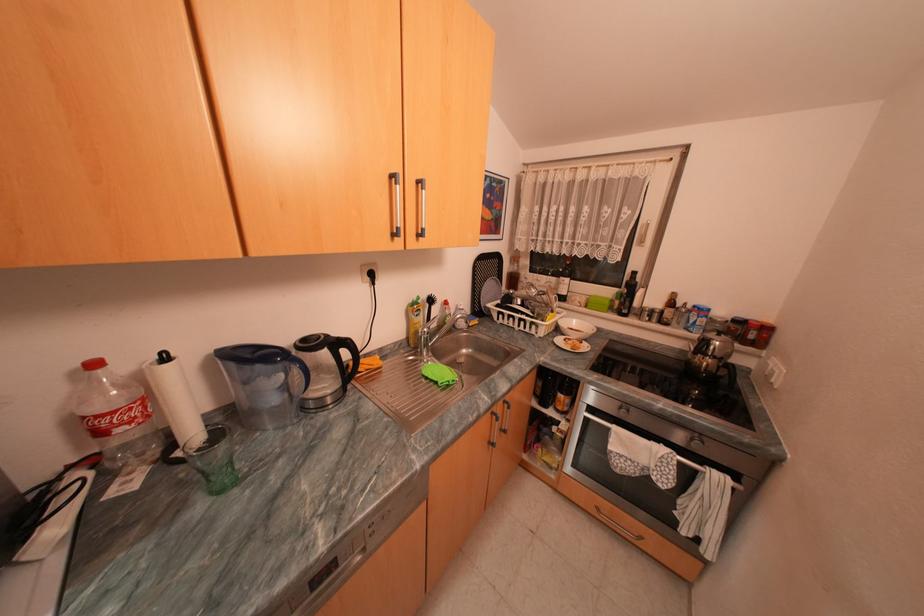
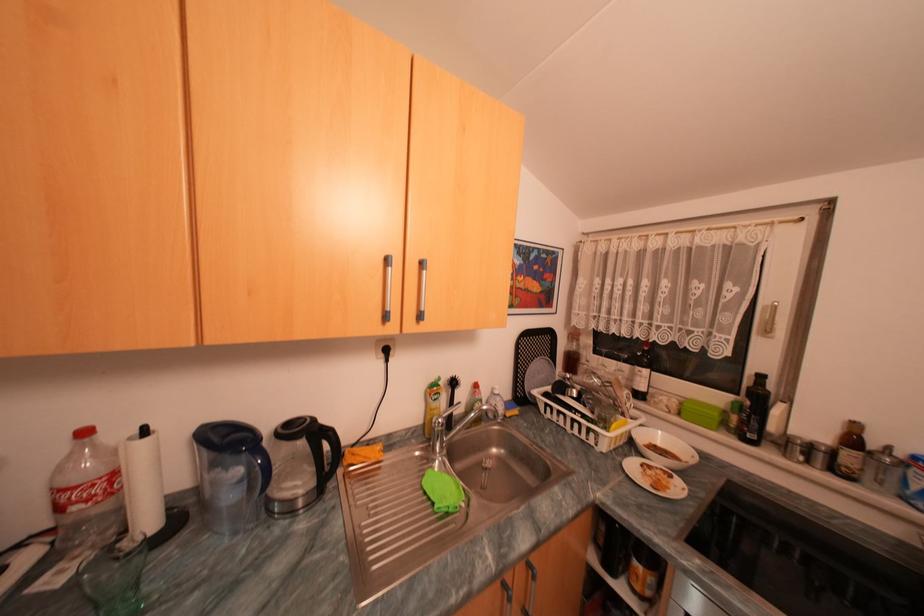
The point at (568, 339) is marked in the first image. Where is the corresponding point in the second image?

(641, 464)